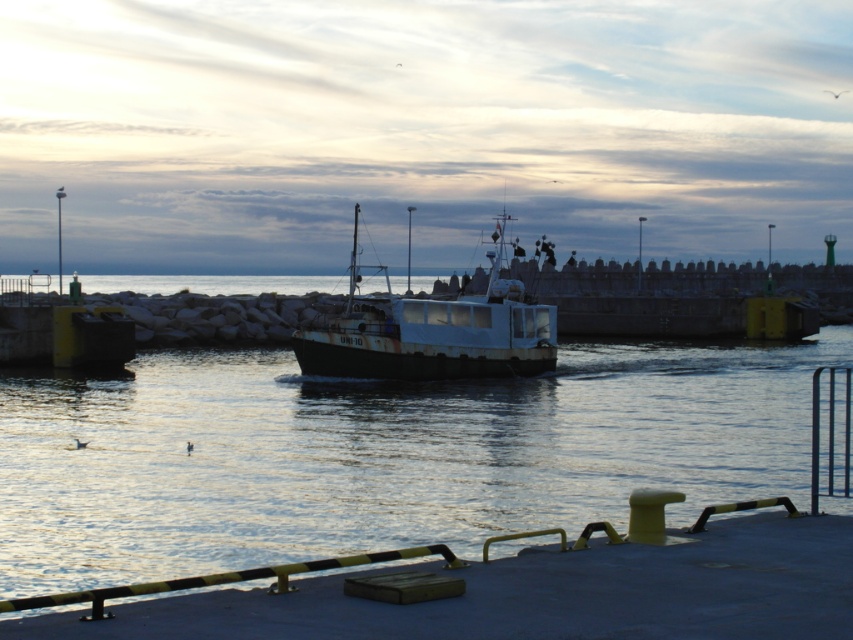
Question: Is shiny metallic water at center in front of smooth rubber dock at lower center?

Choices:
 (A) yes
 (B) no

Answer: (B)

Question: Does shiny metallic water at center appear on the right side of rusty metal boat at center?

Choices:
 (A) no
 (B) yes

Answer: (A)

Question: Does shiny metallic water at center appear on the left side of rusty metal boat at center?

Choices:
 (A) yes
 (B) no

Answer: (A)

Question: Which point appears closest to the camera in this image?

Choices:
 (A) (799, 560)
 (B) (320, 458)
 (C) (555, 346)

Answer: (A)

Question: Considering the real-world distances, which object is closest to the shiny metallic water at center?

Choices:
 (A) smooth rubber dock at lower center
 (B) rusty metal boat at center

Answer: (B)

Question: Which point is farther to the camera?

Choices:
 (A) smooth rubber dock at lower center
 (B) shiny metallic water at center
 (C) rusty metal boat at center

Answer: (C)